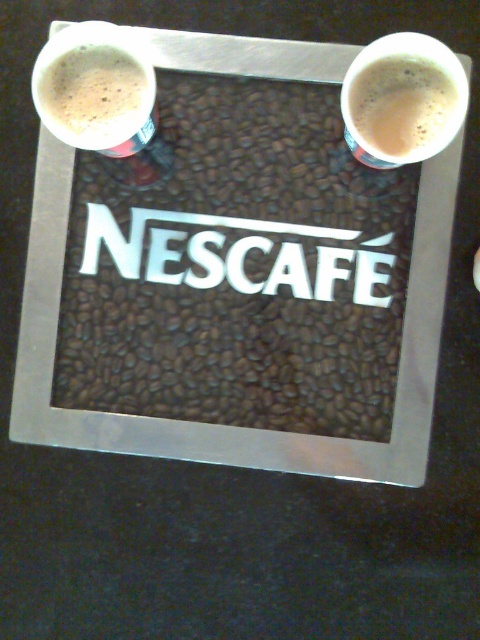
Where is `matte white cup at upper left`? The height and width of the screenshot is (640, 480). matte white cup at upper left is located at coordinates (95, 93).

Does matte white cup at upper left come behind white frothy coffee at upper right?

Yes, matte white cup at upper left is further from the viewer.

This screenshot has width=480, height=640. Find the location of `matte white cup at upper left`. matte white cup at upper left is located at coordinates click(x=95, y=93).

You are a GUI agent. You are given a task and a screenshot of the screen. Output one action in this format:
    pyautogui.click(x=<x>, y=<y>)
    Task: Click on the matte white cup at upper left
    Image resolution: width=480 pixels, height=640 pixels.
    Given the screenshot: What is the action you would take?
    pyautogui.click(x=95, y=93)